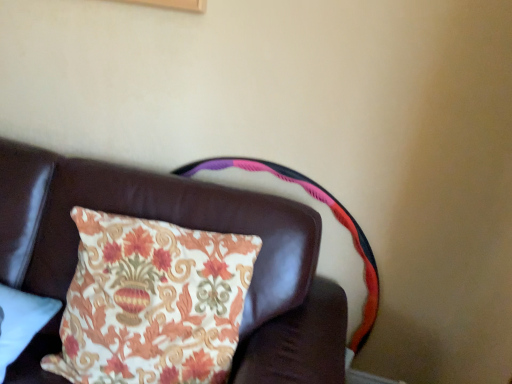
Question: Does point (2, 286) appear closer or farther from the camera than point (335, 284)?

Choices:
 (A) farther
 (B) closer

Answer: (B)

Question: Is floral fabric pillow at lower left situated inside leather couch cushion at upper left or outside?

Choices:
 (A) outside
 (B) inside

Answer: (B)

Question: Based on their relative distances, which object is farther from the leather couch cushion at upper left?

Choices:
 (A) floral fabric cushion at upper center
 (B) floral fabric pillow at lower left

Answer: (B)

Question: Which object is positioned farthest from the floral fabric cushion at upper center?

Choices:
 (A) floral fabric pillow at lower left
 (B) leather couch cushion at upper left

Answer: (A)